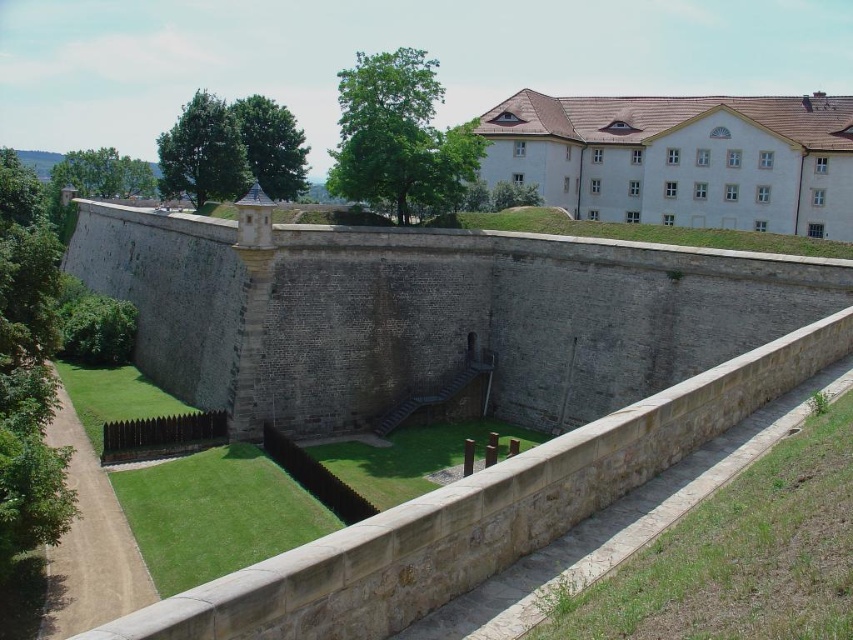
Question: Based on their relative distances, which object is farther from the white stone building at upper right?

Choices:
 (A) gray stone wall at center
 (B) brown stone moat at lower left

Answer: (B)

Question: Which point is closer to the camera?

Choices:
 (A) gray stone wall at center
 (B) brown stone moat at lower left

Answer: (B)

Question: Where is brown stone moat at lower left located in relation to white stone building at upper right in the image?

Choices:
 (A) left
 (B) right

Answer: (A)

Question: Estimate the real-world distances between objects in this image. Which object is farther from the gray stone wall at center?

Choices:
 (A) brown stone moat at lower left
 (B) white stone building at upper right

Answer: (B)

Question: Is gray stone wall at center behind brown stone moat at lower left?

Choices:
 (A) yes
 (B) no

Answer: (A)

Question: Is gray stone wall at center smaller than white stone building at upper right?

Choices:
 (A) no
 (B) yes

Answer: (A)